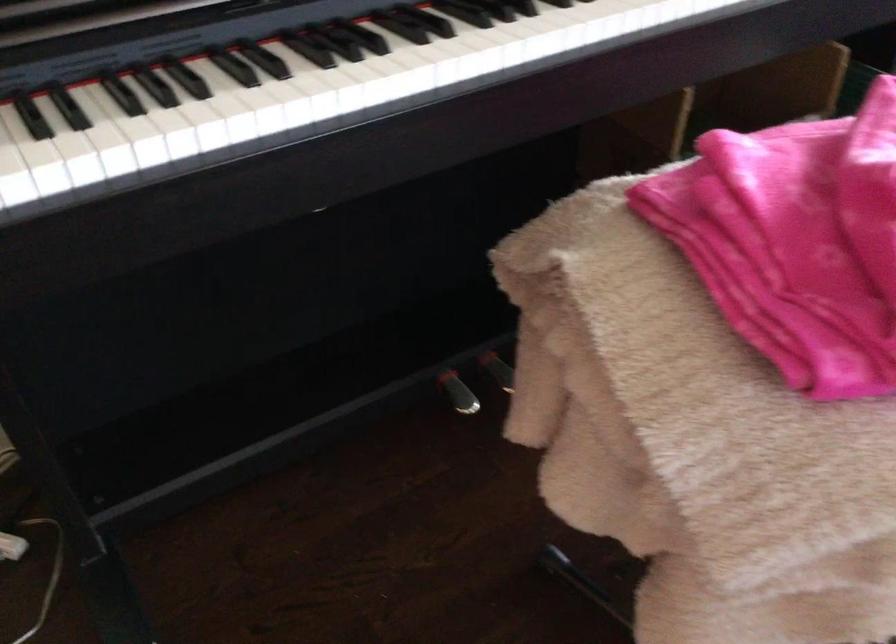
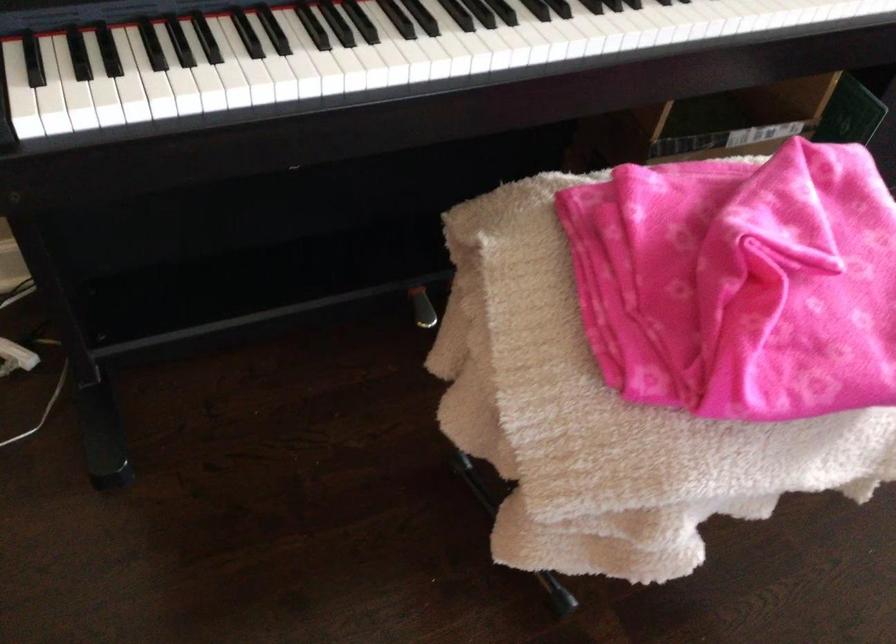
In a continuous first-person perspective shot, in which direction is the camera moving?

The movement direction of the cameraman is right, backward.